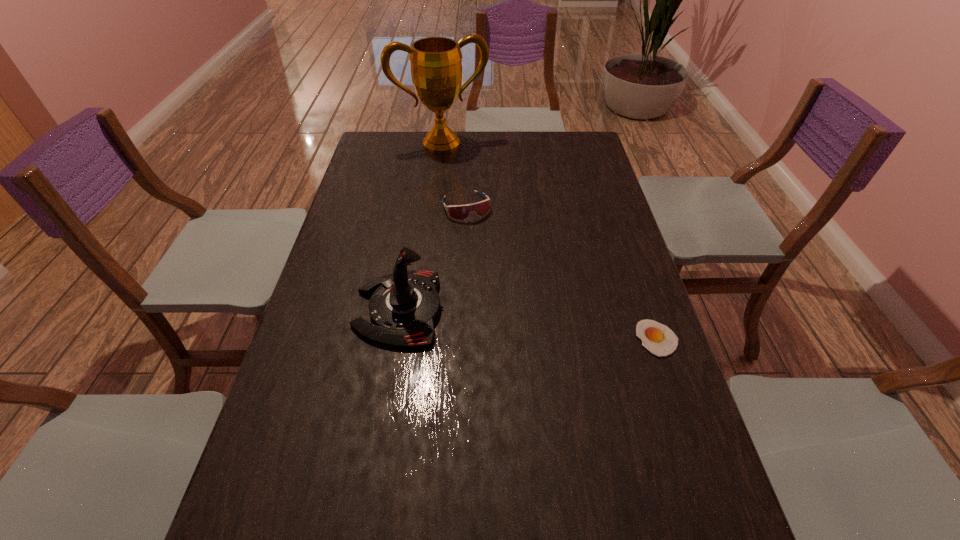
The image size is (960, 540). What are the coordinates of `free space on the desktop that is between the joystick and the rightmost object and is positioned on the front-facing side of the farthest object` in the screenshot? It's located at (521, 323).

You are a GUI agent. You are given a task and a screenshot of the screen. Output one action in this format:
    pyautogui.click(x=<x>, y=<y>)
    Task: Click on the vacant space on the desktop that is between the second tallest object and the rightmost object and is positioned on the front-facing side of the goggles
    The height and width of the screenshot is (540, 960).
    Given the screenshot: What is the action you would take?
    pyautogui.click(x=520, y=323)